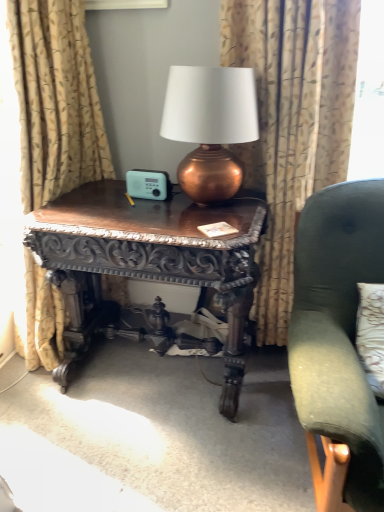
I want to click on free location to the left of copper metallic lamp at center, so click(123, 208).